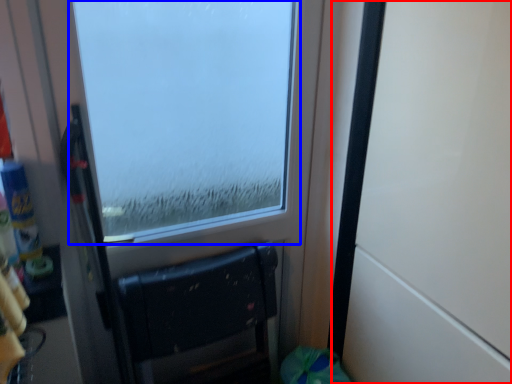
Question: Which point is further to the camera, door (highlighted by a red box) or window (highlighted by a blue box)?

Choices:
 (A) door
 (B) window

Answer: (B)